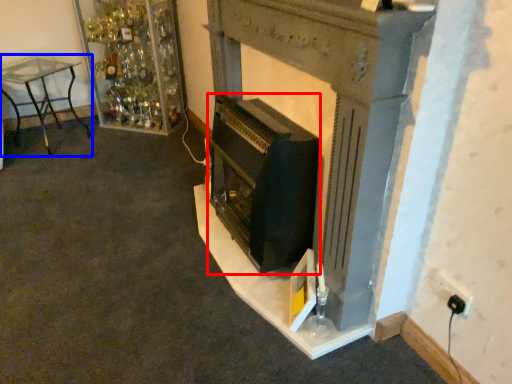
Question: Which point is closer to the camera, wood burning stove (highlighted by a red box) or furniture (highlighted by a blue box)?

Choices:
 (A) wood burning stove
 (B) furniture

Answer: (A)